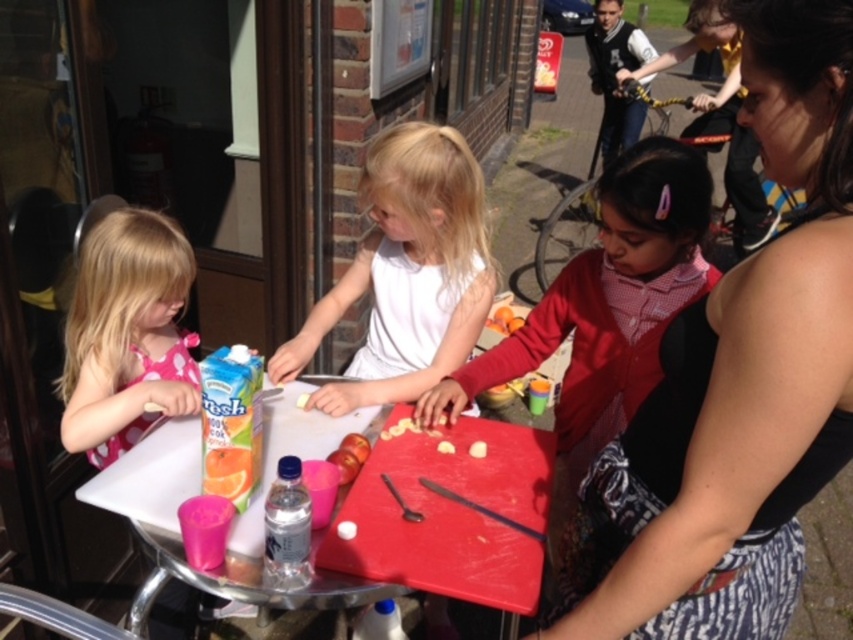
Is matte red jacket at center taller than white matte shirt at center?

Indeed, matte red jacket at center has a greater height compared to white matte shirt at center.

Which of these two, matte red jacket at center or white matte shirt at center, stands taller?

matte red jacket at center is taller.

Where is `matte red jacket at center`? This screenshot has width=853, height=640. matte red jacket at center is located at coordinates (606, 301).

The height and width of the screenshot is (640, 853). What do you see at coordinates (405, 273) in the screenshot?
I see `white matte shirt at center` at bounding box center [405, 273].

Looking at this image, who is lower down, white matte shirt at center or matte plastic table at center?

matte plastic table at center is below.

Which is behind, point (383, 232) or point (256, 556)?

Point (383, 232)

The height and width of the screenshot is (640, 853). Find the location of `white matte shirt at center`. white matte shirt at center is located at coordinates (405, 273).

Can you confirm if matte red jacket at center is shorter than pink fabric dress at left?

No.

From the picture: Who is taller, matte red jacket at center or pink fabric dress at left?

matte red jacket at center is taller.

Which is behind, point (618, 292) or point (88, 410)?

Point (618, 292)

This screenshot has width=853, height=640. I want to click on matte red jacket at center, so click(606, 301).